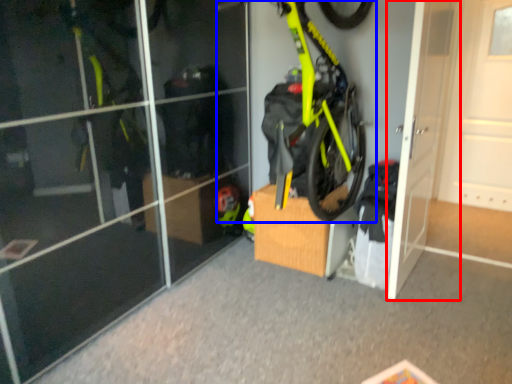
Question: Which of the following is the farthest to the observer, door (highlighted by a red box) or bicycle (highlighted by a blue box)?

Choices:
 (A) door
 (B) bicycle

Answer: (A)